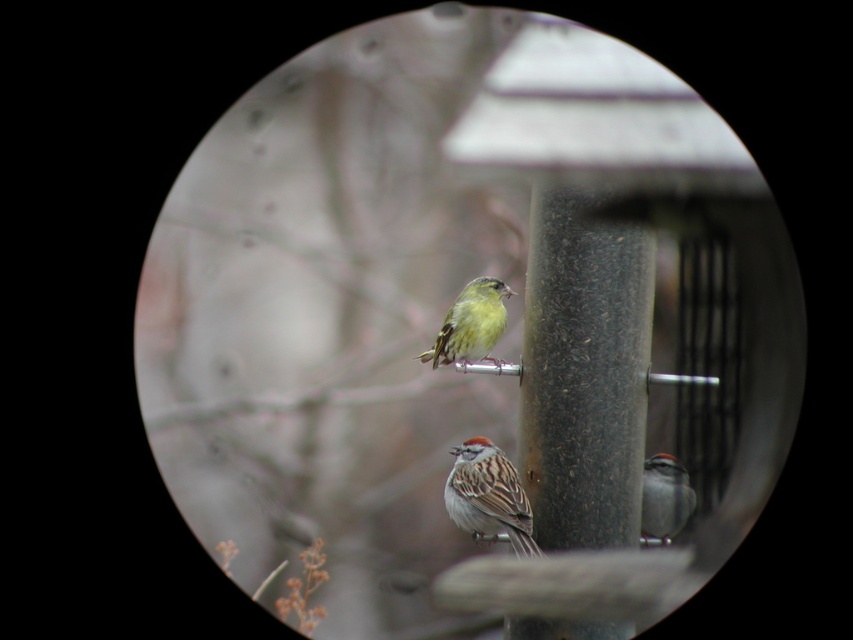
You are a birdwatcher observing the scene through the lens. You notice two sparrows on the feeder. Which sparrow has a greater width between the brown speckled sparrow at lower center and the gray matte sparrow at lower right?

The brown speckled sparrow at lower center has a greater width than the gray matte sparrow at lower right.